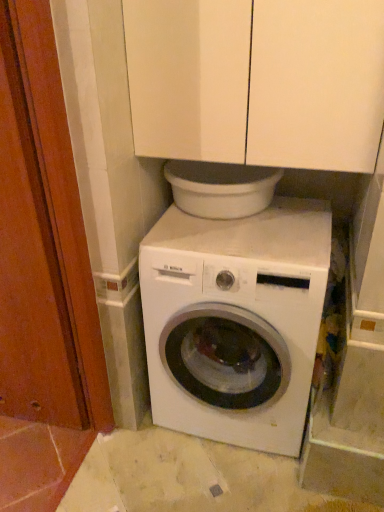
Identify the location of free space above white glossy washing machine at center (from a real-world perspective). This screenshot has height=512, width=384. (253, 224).